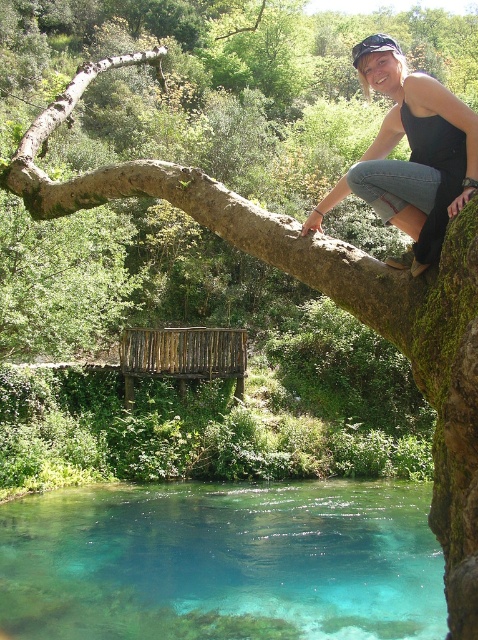
In the scene shown: Does clear glassy water at lower center have a lesser width compared to black denim jeans at upper right?

No.

Is point (415, 541) farther from camera compared to point (442, 196)?

Yes, it is behind point (442, 196).

Does point (401, 525) come closer to viewer compared to point (403, 104)?

That is False.

Image resolution: width=478 pixels, height=640 pixels. In order to click on clear glassy water at lower center in this screenshot , I will do `click(223, 563)`.